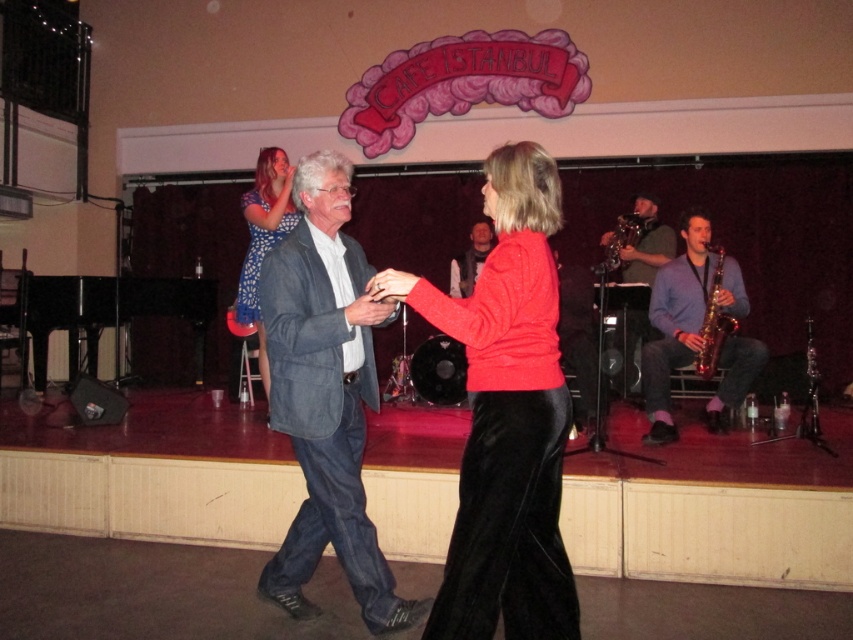
Question: Can you confirm if denim jacket at center is thinner than matte gray suit at center?

Choices:
 (A) yes
 (B) no

Answer: (B)

Question: Which of the following is the farthest from the observer?

Choices:
 (A) (486, 237)
 (B) (641, 230)
 (C) (695, 365)

Answer: (B)

Question: Which of the following is the farthest from the observer?

Choices:
 (A) blue dotted dress at upper left
 (B) blue sweater at right

Answer: (B)

Question: Which of the following is the closest to the observer?

Choices:
 (A) (554, 445)
 (B) (308, 266)

Answer: (A)

Question: Is blue dotted dress at upper left positioned in front of shiny silver saxophone at right?

Choices:
 (A) no
 (B) yes

Answer: (B)

Question: Does blue sweater at right have a lesser width compared to shiny silver saxophone at right?

Choices:
 (A) no
 (B) yes

Answer: (A)